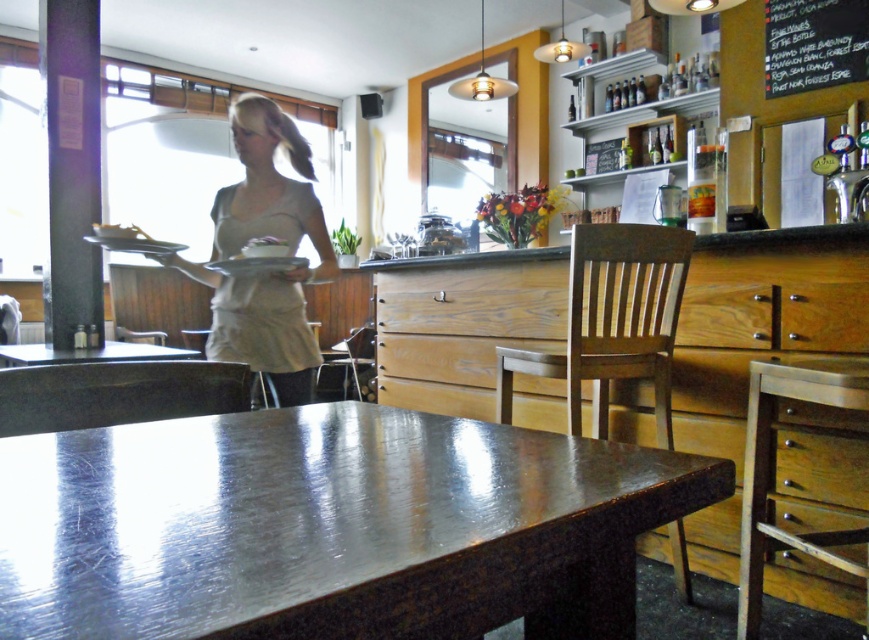
Question: Considering the real-world distances, which object is farthest from the matte white platter at center?

Choices:
 (A) beige fabric apron at center
 (B) black chalkboard at upper right
 (C) shiny metallic table at center
 (D) metallic polished chair at lower center

Answer: (B)

Question: Can you confirm if metallic polished chair at lower center is positioned to the left of shiny black table at center?

Choices:
 (A) no
 (B) yes

Answer: (A)

Question: Which point is farther from the camera taking this photo?

Choices:
 (A) (673, 280)
 (B) (85, 612)
 (C) (839, 35)

Answer: (C)

Question: Which is farther from the shiny black table at center?

Choices:
 (A) black chalkboard at upper right
 (B) beige fabric apron at center

Answer: (A)

Question: Can you confirm if metallic polished chair at lower center is thinner than black chalkboard at upper right?

Choices:
 (A) yes
 (B) no

Answer: (A)

Question: Does metallic polished chair at lower center have a larger size compared to matte white platter at center?

Choices:
 (A) no
 (B) yes

Answer: (B)